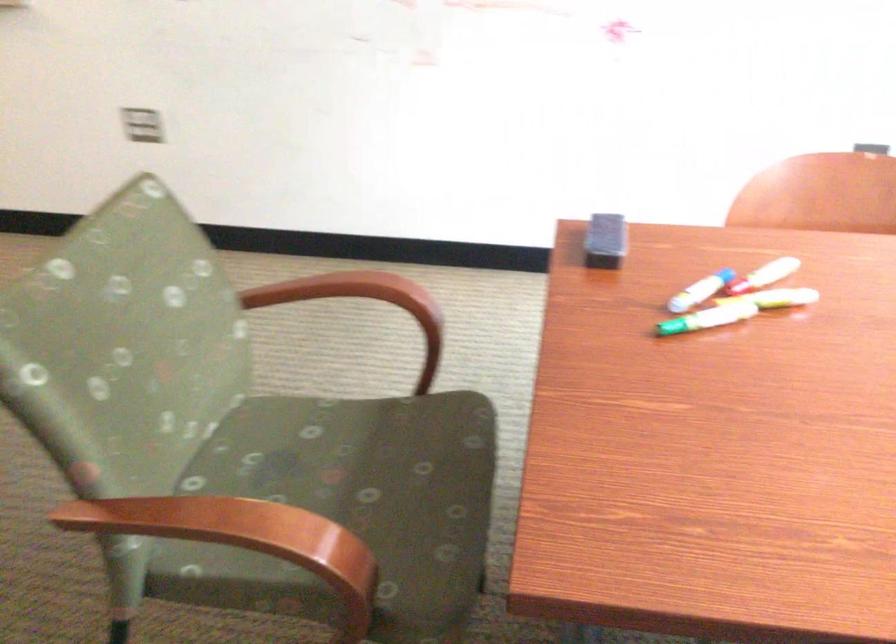
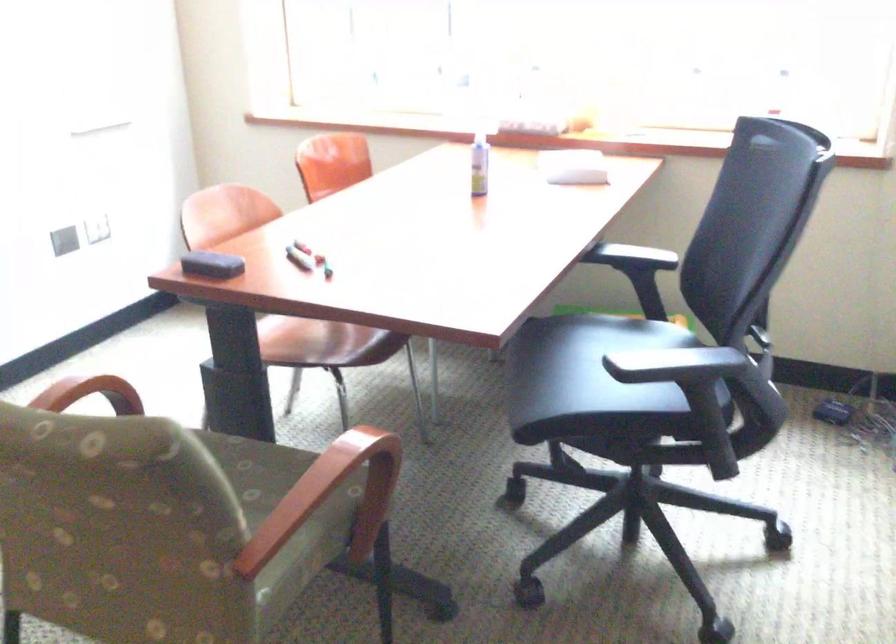
Locate, in the second image, the point that corresponds to [703,290] in the first image.

(299, 258)